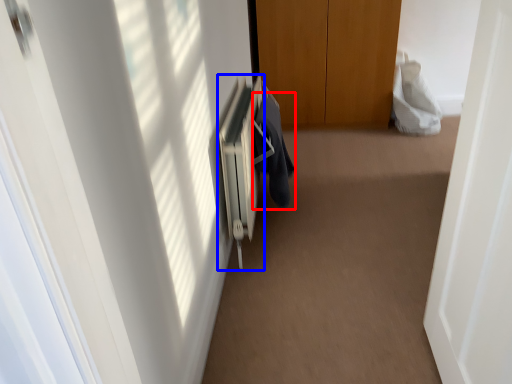
Question: Which of the following is the farthest to the observer, robe (highlighted by a red box) or radiator (highlighted by a blue box)?

Choices:
 (A) robe
 (B) radiator

Answer: (A)